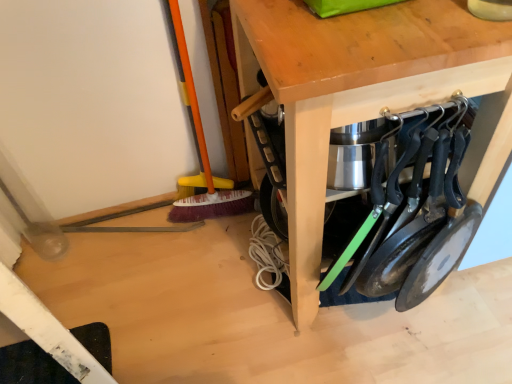
The width and height of the screenshot is (512, 384). Find the location of `wooden table at center`. wooden table at center is located at coordinates (368, 94).

Describe the element at coordinates (368, 94) in the screenshot. Image resolution: width=512 pixels, height=384 pixels. I see `wooden table at center` at that location.

In order to click on black matte frying pans at lower right in this screenshot , I will do (420, 209).

Describe the element at coordinates (420, 209) in the screenshot. I see `black matte frying pans at lower right` at that location.

Where is `wooden table at center`? Image resolution: width=512 pixels, height=384 pixels. wooden table at center is located at coordinates (368, 94).

Considering the relative positions of wooden table at center and black matte frying pans at lower right in the image provided, is wooden table at center to the left of black matte frying pans at lower right from the viewer's perspective?

Correct, you'll find wooden table at center to the left of black matte frying pans at lower right.

Does wooden table at center come in front of black matte frying pans at lower right?

Yes, wooden table at center is in front of black matte frying pans at lower right.

Between point (317, 146) and point (445, 203), which one is positioned behind?

The point (445, 203) is more distant.

From the image's perspective, does wooden table at center appear higher than black matte frying pans at lower right?

Indeed, from the image's perspective, wooden table at center is shown above black matte frying pans at lower right.

From a real-world perspective, between wooden table at center and black matte frying pans at lower right, who is vertically higher?

In real-world perspective, black matte frying pans at lower right is above.

In the scene shown: Looking at their sizes, would you say wooden table at center is wider or thinner than black matte frying pans at lower right?

In the image, wooden table at center appears to be wider than black matte frying pans at lower right.

Based on the photo, in terms of height, does wooden table at center look taller or shorter compared to black matte frying pans at lower right?

Clearly, wooden table at center is taller compared to black matte frying pans at lower right.

Is wooden table at center bigger or smaller than black matte frying pans at lower right?

wooden table at center is bigger than black matte frying pans at lower right.

Is wooden table at center not inside black matte frying pans at lower right?

That's correct, wooden table at center is outside of black matte frying pans at lower right.

Is wooden table at center in contact with black matte frying pans at lower right?

No, wooden table at center is not beside black matte frying pans at lower right.

Is wooden table at center looking in the opposite direction of black matte frying pans at lower right?

Yes, wooden table at center is positioned with its back facing black matte frying pans at lower right.

Can you tell me how much wooden table at center and black matte frying pans at lower right differ in facing direction?

They differ by 0.000936 degrees in their facing directions.

Locate an element on the screen. The width and height of the screenshot is (512, 384). tool behind the wooden table at center is located at coordinates (420, 209).

Considering the positions of objects black matte frying pans at lower right and wooden table at center in the image provided, who is more to the left, black matte frying pans at lower right or wooden table at center?

Positioned to the left is wooden table at center.

Is black matte frying pans at lower right positioned before wooden table at center?

No, it is behind wooden table at center.

Which is less distant, (x=460, y=152) or (x=357, y=90)?

Point (x=460, y=152) is farther from the camera than point (x=357, y=90).

From the image's perspective, between black matte frying pans at lower right and wooden table at center, which one is located above?

wooden table at center.

From a real-world perspective, is black matte frying pans at lower right on top of wooden table at center?

Yes, from a real-world perspective, black matte frying pans at lower right is over wooden table at center

Looking at their sizes, would you say black matte frying pans at lower right is wider or thinner than wooden table at center?

Clearly, black matte frying pans at lower right has less width compared to wooden table at center.

Who is taller, black matte frying pans at lower right or wooden table at center?

wooden table at center.

Between black matte frying pans at lower right and wooden table at center, which one has larger size?

wooden table at center is bigger.

Is black matte frying pans at lower right spatially inside wooden table at center, or outside of it?

black matte frying pans at lower right is located beyond the bounds of wooden table at center.

Is black matte frying pans at lower right placed right next to wooden table at center?

No, black matte frying pans at lower right is not beside wooden table at center.

Is black matte frying pans at lower right aimed at wooden table at center?

Yes, black matte frying pans at lower right faces towards wooden table at center.

How different are the orientations of black matte frying pans at lower right and wooden table at center in degrees?

The facing directions of black matte frying pans at lower right and wooden table at center are 0.000936 degrees apart.

Locate an element on the screen. table that is on the left side of black matte frying pans at lower right is located at coordinates (368, 94).

This screenshot has width=512, height=384. I want to click on table located above the black matte frying pans at lower right (from the image's perspective), so click(368, 94).

At what (x,y) coordinates should I click in order to perform the action: click on table in front of the black matte frying pans at lower right. Please return your answer as a coordinate pair (x, y). This screenshot has width=512, height=384. Looking at the image, I should click on (368, 94).